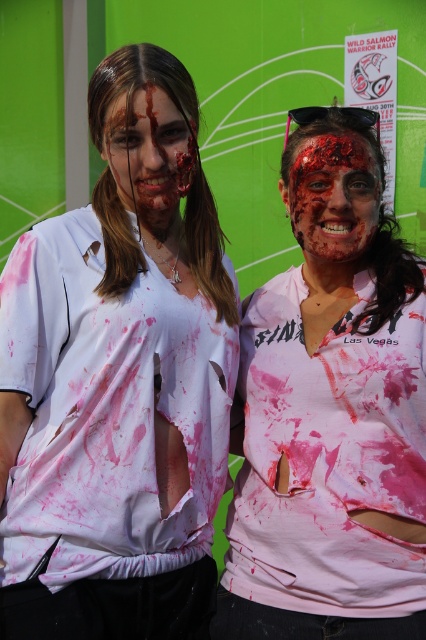
Question: Does white matte shirt at center have a larger size compared to blood-stained face at center?

Choices:
 (A) no
 (B) yes

Answer: (B)

Question: Which object appears closest to the camera in this image?

Choices:
 (A) bloody skin at center
 (B) pink matte shirt at center

Answer: (B)

Question: In this image, where is pink matte shirt at center located relative to blood-stained face at center?

Choices:
 (A) right
 (B) left

Answer: (A)

Question: Which point is farther from the camera taking this photo?

Choices:
 (A) (397, 524)
 (B) (117, 140)
 (C) (359, 166)

Answer: (C)

Question: Does white matte shirt at center have a smaller size compared to blood-stained face at center?

Choices:
 (A) yes
 (B) no

Answer: (B)

Question: Which of the following is the farthest from the observer?

Choices:
 (A) (360, 237)
 (B) (181, 163)
 (C) (371, 196)

Answer: (C)